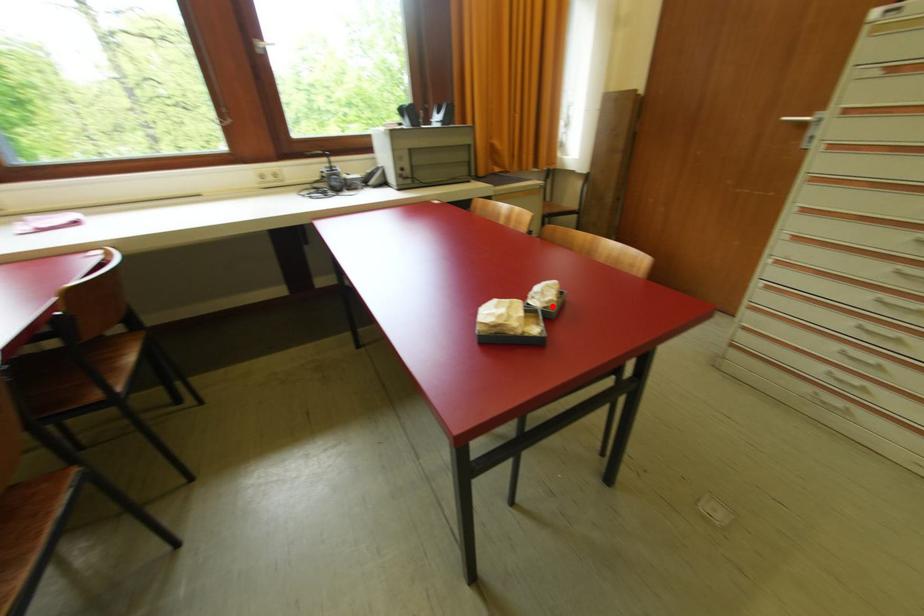
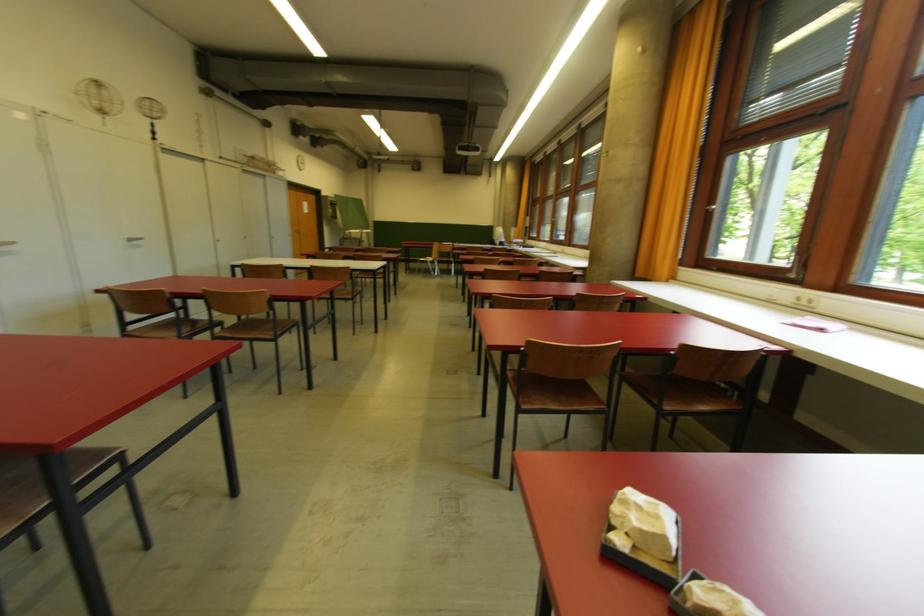
The point at the highlighted location is marked in the first image. Where is the corresponding point in the second image?

(690, 596)